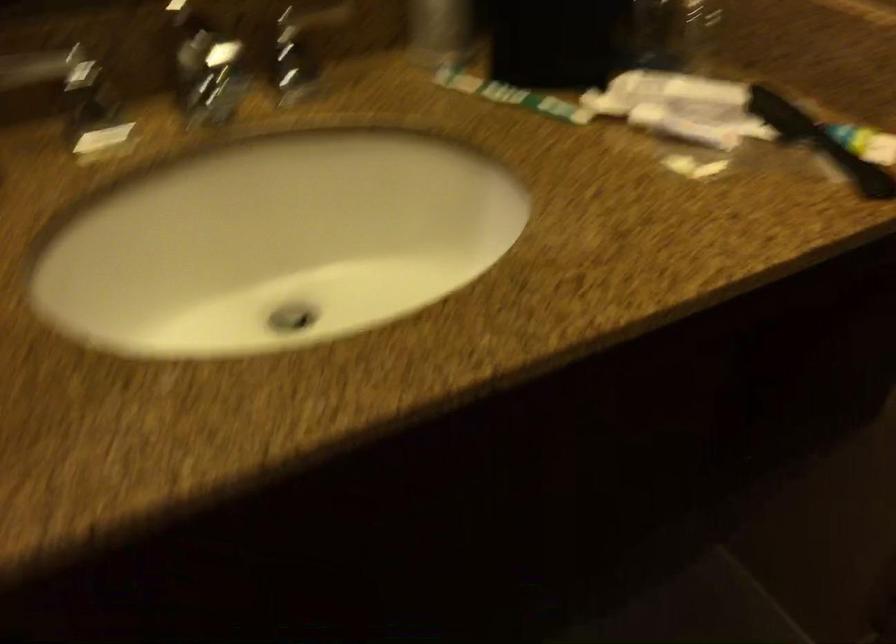
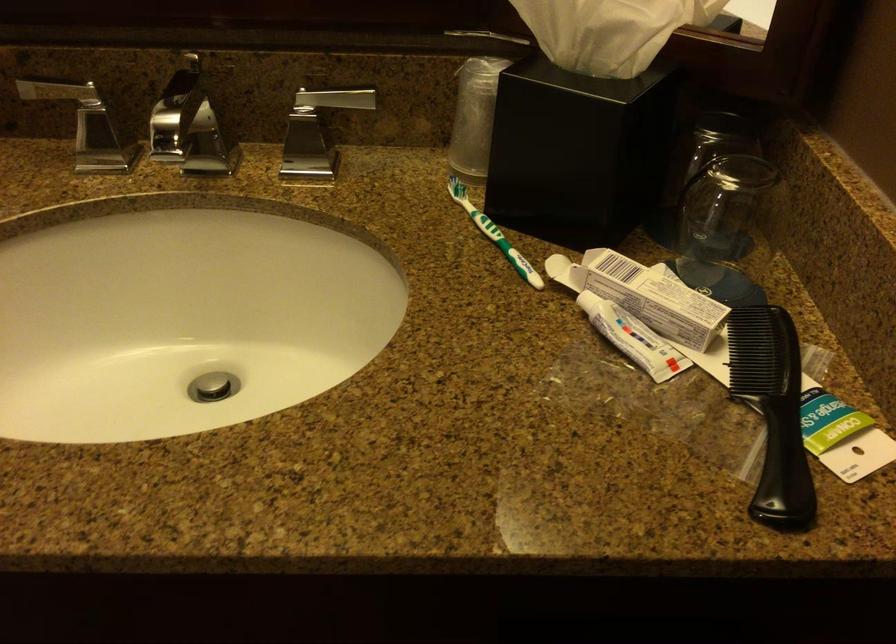
Find the pixel in the second image that matches pixel 291 315 in the first image.

(212, 386)